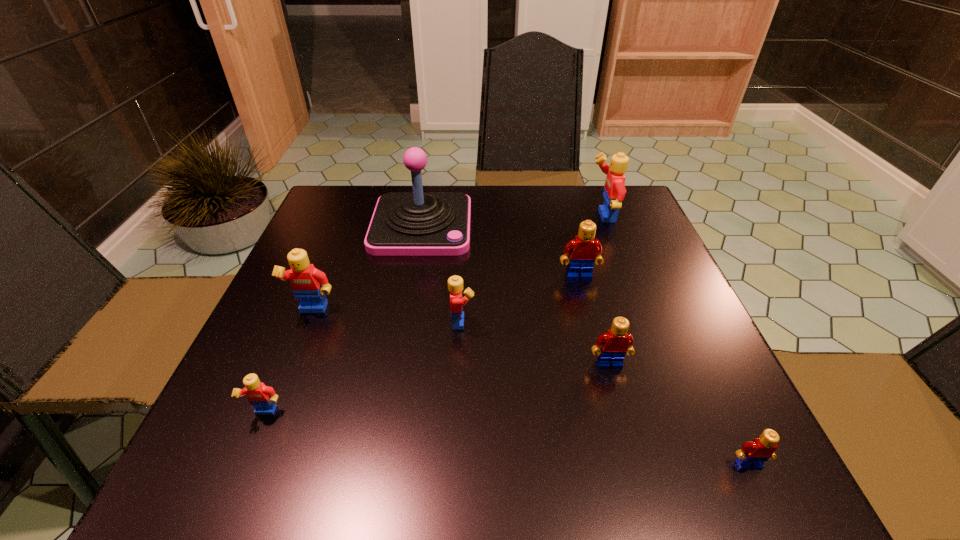
Locate an element on the screen. The width and height of the screenshot is (960, 540). the tallest object is located at coordinates (417, 223).

You are a GUI agent. You are given a task and a screenshot of the screen. Output one action in this format:
    pyautogui.click(x=<x>, y=<y>)
    Task: Click on the joystick
    
    Given the screenshot: What is the action you would take?
    pyautogui.click(x=417, y=223)

Where is `the sixth Lego from left to right`? The image size is (960, 540). the sixth Lego from left to right is located at coordinates (614, 192).

You are a GUI agent. You are given a task and a screenshot of the screen. Output one action in this format:
    pyautogui.click(x=<x>, y=<y>)
    Task: Click on the farthest Lego
    The height and width of the screenshot is (540, 960).
    Given the screenshot: What is the action you would take?
    pyautogui.click(x=614, y=192)

At what (x,y) coordinates should I click in order to perform the action: click on the farthest red Lego. Please return your answer as a coordinate pair (x, y). This screenshot has height=540, width=960. Looking at the image, I should click on (584, 250).

Where is `the second farthest Lego`? the second farthest Lego is located at coordinates (584, 250).

Where is `the third smallest yellow Lego`? The image size is (960, 540). the third smallest yellow Lego is located at coordinates (308, 284).

You are a GUI agent. You are given a task and a screenshot of the screen. Output one action in this format:
    pyautogui.click(x=<x>, y=<y>)
    Task: Click on the third biggest yellow Lego
    
    Given the screenshot: What is the action you would take?
    pyautogui.click(x=455, y=283)

The width and height of the screenshot is (960, 540). Identify the location of the third yellow Lego from left to right. (455, 283).

This screenshot has height=540, width=960. I want to click on the second smallest red Lego, so click(615, 343).